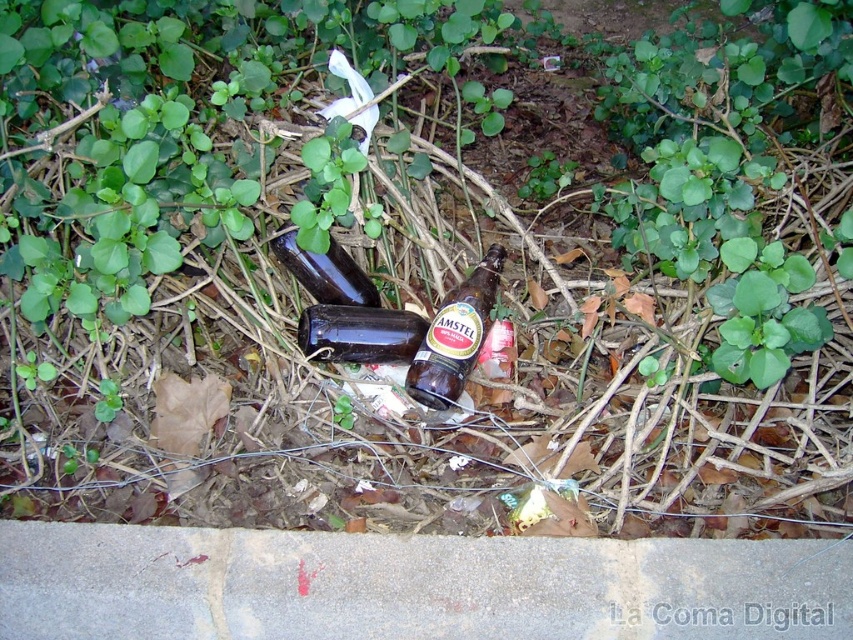
Question: Which point is farther to the camera?

Choices:
 (A) concrete at lower left
 (B) amber glass bottle at center

Answer: (B)

Question: Can you confirm if concrete at lower left is positioned to the right of dark glass bottle at center?

Choices:
 (A) yes
 (B) no

Answer: (A)

Question: Which point is closer to the camera?

Choices:
 (A) dark glass bottle at center
 (B) amber glass bottle at center
 (C) concrete at lower left
 (D) shiny dark brown bottle at center

Answer: (C)

Question: Among these points, which one is farthest from the camera?

Choices:
 (A) (447, 385)
 (B) (363, 342)
 (C) (589, 612)
 (D) (289, 269)

Answer: (D)

Question: Does amber glass bottle at center come in front of shiny dark brown bottle at center?

Choices:
 (A) no
 (B) yes

Answer: (B)

Question: Is the position of concrete at lower left more distant than that of shiny dark brown bottle at center?

Choices:
 (A) no
 (B) yes

Answer: (A)